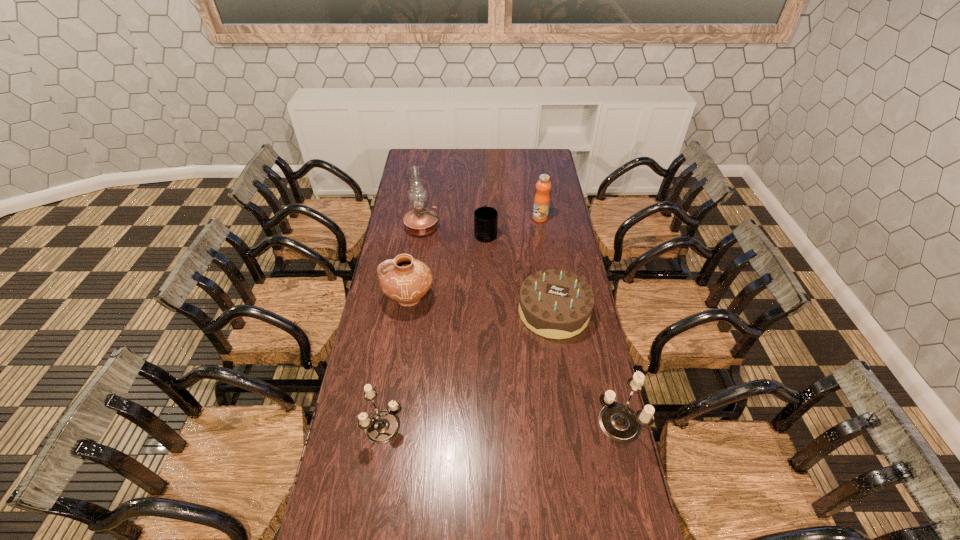
Where is `free space between the fruit juice and the pottery`? free space between the fruit juice and the pottery is located at coordinates (474, 259).

Find the location of a particular element. object that is the nearest to the birthday cake is located at coordinates (618, 422).

Locate an element on the screen. The height and width of the screenshot is (540, 960). object that can be found as the closest to the tallest object is located at coordinates (485, 218).

You are a GUI agent. You are given a task and a screenshot of the screen. Output one action in this format:
    pyautogui.click(x=<x>, y=<y>)
    Task: Click on the free point that satisfies the following two spatial constraints: 1. on the side of the pottery with the handle; 2. on the right side of the fruit juice
    This screenshot has width=960, height=540.
    Given the screenshot: What is the action you would take?
    pyautogui.click(x=421, y=218)